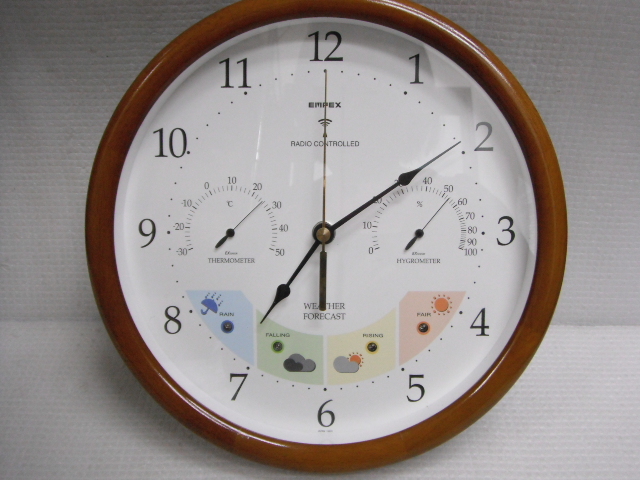
This screenshot has width=640, height=480. What are the coordinates of `corner` in the screenshot? It's located at (44, 343).